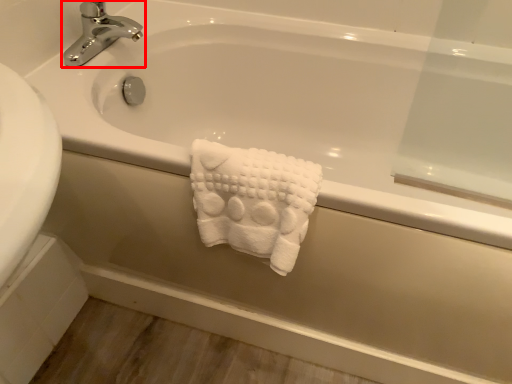
Question: From the image, what is the correct spatial relationship of tap (annotated by the red box) in relation to towel?

Choices:
 (A) left
 (B) right

Answer: (A)